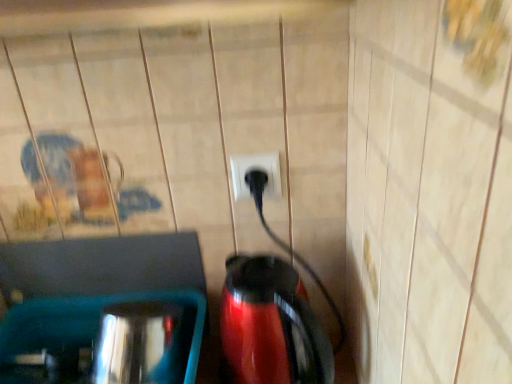
Locate an element on the screen. black plastic plug at center is located at coordinates (256, 169).

The width and height of the screenshot is (512, 384). What do you see at coordinates (256, 169) in the screenshot? I see `black plastic plug at center` at bounding box center [256, 169].

Where is `glossy plastic coffee pot at center`? This screenshot has height=384, width=512. glossy plastic coffee pot at center is located at coordinates (271, 325).

In order to face glossy plastic coffee pot at center, should I rotate leftwards or rightwards?

To align with it, rotate right about 3.385°.

The image size is (512, 384). Describe the element at coordinates (271, 325) in the screenshot. I see `glossy plastic coffee pot at center` at that location.

Image resolution: width=512 pixels, height=384 pixels. In order to click on black plastic plug at center in this screenshot , I will do `click(256, 169)`.

Considering the relative positions of glossy plastic coffee pot at center and black plastic plug at center in the image provided, is glossy plastic coffee pot at center to the right of black plastic plug at center from the viewer's perspective?

Yes, glossy plastic coffee pot at center is to the right of black plastic plug at center.

Considering the positions of objects glossy plastic coffee pot at center and black plastic plug at center in the image provided, who is in front, glossy plastic coffee pot at center or black plastic plug at center?

glossy plastic coffee pot at center is more forward.

Does point (282, 351) lie behind point (240, 177)?

That is False.

From the image's perspective, would you say glossy plastic coffee pot at center is positioned over black plastic plug at center?

No, from the image's perspective, glossy plastic coffee pot at center is not above black plastic plug at center.

From a real-world perspective, which is physically above, glossy plastic coffee pot at center or black plastic plug at center?

black plastic plug at center is physically above.

Considering the sizes of objects glossy plastic coffee pot at center and black plastic plug at center in the image provided, who is thinner, glossy plastic coffee pot at center or black plastic plug at center?

black plastic plug at center.

Does glossy plastic coffee pot at center have a lesser height compared to black plastic plug at center?

Incorrect, the height of glossy plastic coffee pot at center does not fall short of that of black plastic plug at center.

Does glossy plastic coffee pot at center have a smaller size compared to black plastic plug at center?

No.

Would you say glossy plastic coffee pot at center is outside black plastic plug at center?

Yes.

Is glossy plastic coffee pot at center placed right next to black plastic plug at center?

There is a gap between glossy plastic coffee pot at center and black plastic plug at center.

Could you tell me if glossy plastic coffee pot at center is turned towards black plastic plug at center?

No, glossy plastic coffee pot at center is not turned towards black plastic plug at center.

What's the angular difference between glossy plastic coffee pot at center and black plastic plug at center's facing directions?

The angular difference between glossy plastic coffee pot at center and black plastic plug at center is 0.00227 degrees.

The height and width of the screenshot is (384, 512). Find the location of `coffeepot beneath the black plastic plug at center (from a real-world perspective)`. coffeepot beneath the black plastic plug at center (from a real-world perspective) is located at coordinates (271, 325).

Would you say black plastic plug at center is to the left or to the right of glossy plastic coffee pot at center in the picture?

In the image, black plastic plug at center appears on the left side of glossy plastic coffee pot at center.

Considering the positions of objects black plastic plug at center and glossy plastic coffee pot at center in the image provided, who is behind, black plastic plug at center or glossy plastic coffee pot at center?

black plastic plug at center is further away from the camera.

Is point (253, 166) positioned in front of point (268, 309)?

No.

From the image's perspective, which is above, black plastic plug at center or glossy plastic coffee pot at center?

black plastic plug at center, from the image's perspective.

From a real-world perspective, relative to glossy plastic coffee pot at center, is black plastic plug at center vertically above or below?

From a real-world perspective, black plastic plug at center is physically above glossy plastic coffee pot at center.

Between black plastic plug at center and glossy plastic coffee pot at center, which one has smaller width?

black plastic plug at center.

Can you confirm if black plastic plug at center is taller than glossy plastic coffee pot at center?

Incorrect, the height of black plastic plug at center is not larger of that of glossy plastic coffee pot at center.

Considering the sizes of objects black plastic plug at center and glossy plastic coffee pot at center in the image provided, who is smaller, black plastic plug at center or glossy plastic coffee pot at center?

black plastic plug at center.

Is black plastic plug at center outside of glossy plastic coffee pot at center?

Yes, black plastic plug at center is not within glossy plastic coffee pot at center.

Is black plastic plug at center placed right next to glossy plastic coffee pot at center?

No, black plastic plug at center is not next to glossy plastic coffee pot at center.

Could you tell me if black plastic plug at center is facing glossy plastic coffee pot at center?

No, black plastic plug at center is not facing towards glossy plastic coffee pot at center.

What's the angular difference between black plastic plug at center and glossy plastic coffee pot at center's facing directions?

The angular difference between black plastic plug at center and glossy plastic coffee pot at center is 0.00227 degrees.

How much distance is there between black plastic plug at center and glossy plastic coffee pot at center?

black plastic plug at center and glossy plastic coffee pot at center are 20.58 centimeters apart from each other.

This screenshot has height=384, width=512. I want to click on power plugs and sockets above the glossy plastic coffee pot at center (from a real-world perspective), so click(256, 169).

Locate an element on the screen. The height and width of the screenshot is (384, 512). coffeepot below the black plastic plug at center (from the image's perspective) is located at coordinates (271, 325).

I want to click on power plugs and sockets that appears behind the glossy plastic coffee pot at center, so click(256, 169).